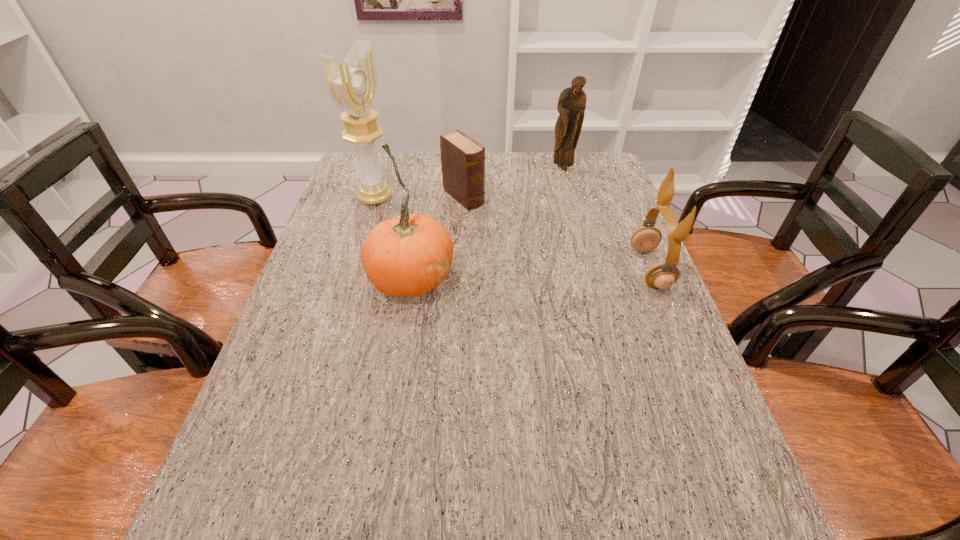
The height and width of the screenshot is (540, 960). Identify the location of pumpkin. (410, 255).

At what (x,y) coordinates should I click in order to perform the action: click on the second shortest object. Please return your answer as a coordinate pair (x, y). The width and height of the screenshot is (960, 540). Looking at the image, I should click on (663, 275).

The image size is (960, 540). I want to click on the rightmost object, so 663,275.

At what (x,y) coordinates should I click in order to perform the action: click on award. Please return your answer as a coordinate pair (x, y). Looking at the image, I should click on (352, 85).

The height and width of the screenshot is (540, 960). In order to click on diary in this screenshot , I will do `click(462, 159)`.

Identify the location of the farthest object. (571, 105).

Find the location of a particular element. the fourth object from left to right is located at coordinates (571, 105).

Locate an element on the screen. The height and width of the screenshot is (540, 960). vacant space located on the front of the pumpkin is located at coordinates (383, 450).

Locate an element on the screen. The width and height of the screenshot is (960, 540). free location located 0.370m on the front-facing side of the award is located at coordinates (492, 246).

Locate an element on the screen. vacant area situated on the front-facing side of the award is located at coordinates (465, 235).